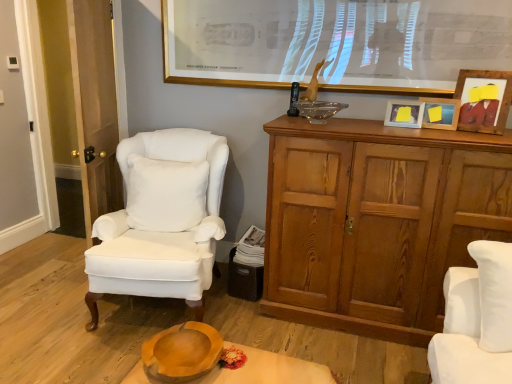
Where is `free point behind white matte picture frame at upper right, positioned as the 3th picture frame in right-to-left order`? This screenshot has height=384, width=512. free point behind white matte picture frame at upper right, positioned as the 3th picture frame in right-to-left order is located at coordinates (380, 116).